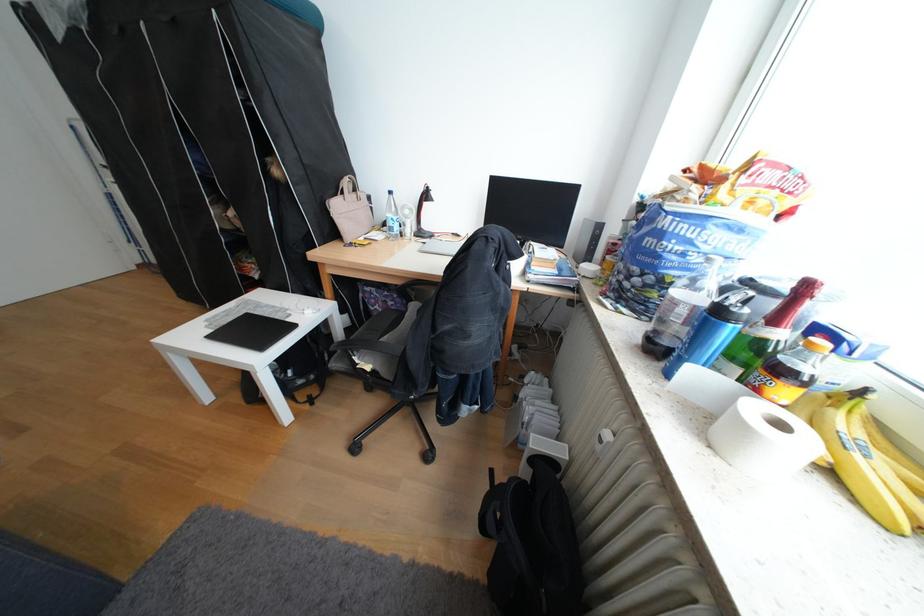
Where would you lift the clear soda bottle? Please return your answer as a coordinate pair (x, y).

(681, 309)